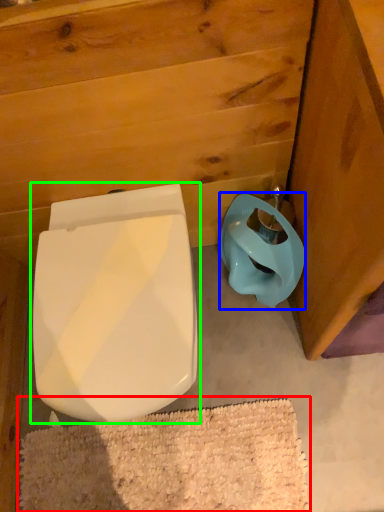
Question: Which object is positioned closest to bath mat (highlighted by a red box)? Select from toilet bowl (highlighted by a blue box) and toilet (highlighted by a green box).

Choices:
 (A) toilet bowl
 (B) toilet

Answer: (B)